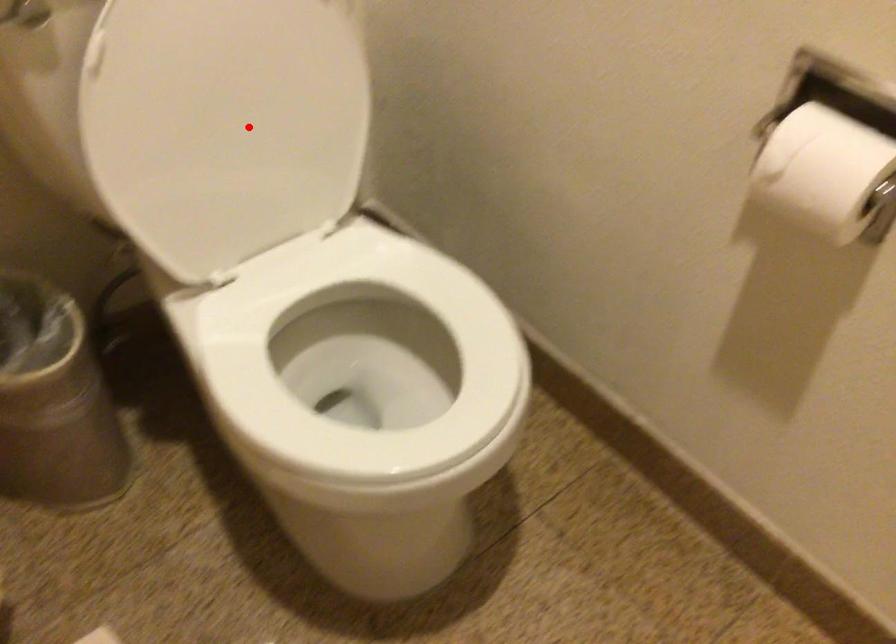
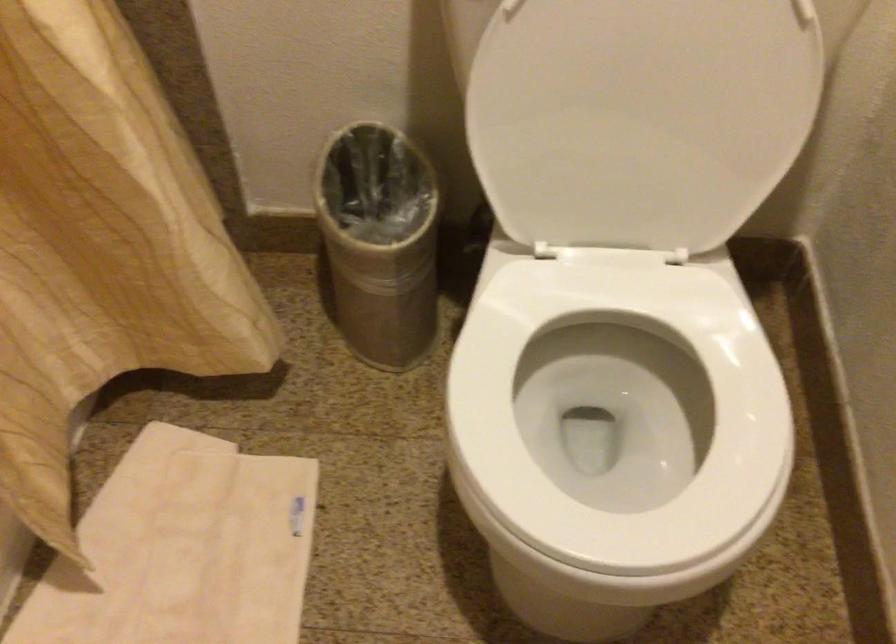
Question: I am providing you with two images of the same scene from different viewpoints. A red point is shown in image1. For the corresponding object point in image2, is it positioned nearer or farther from the camera?

Choices:
 (A) Nearer
 (B) Farther

Answer: (A)